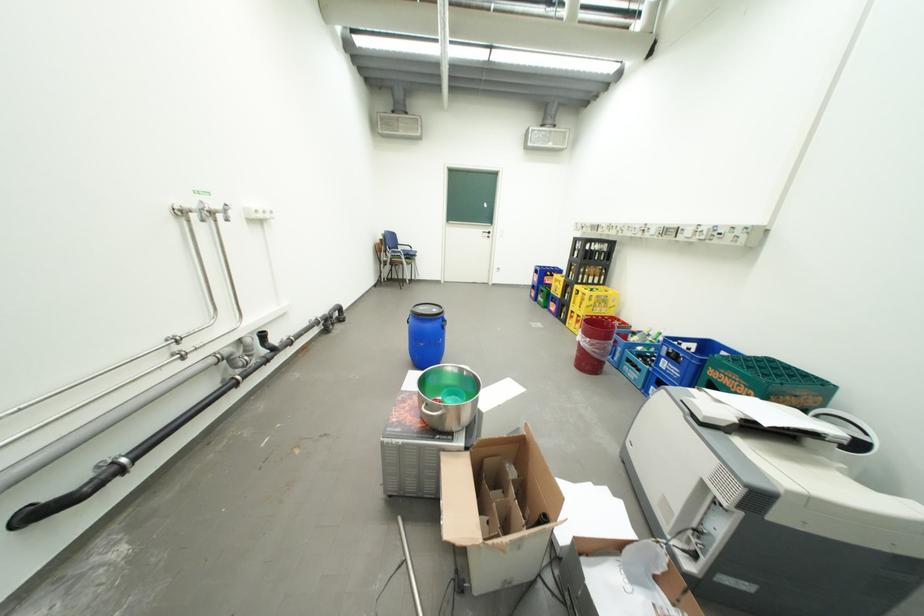
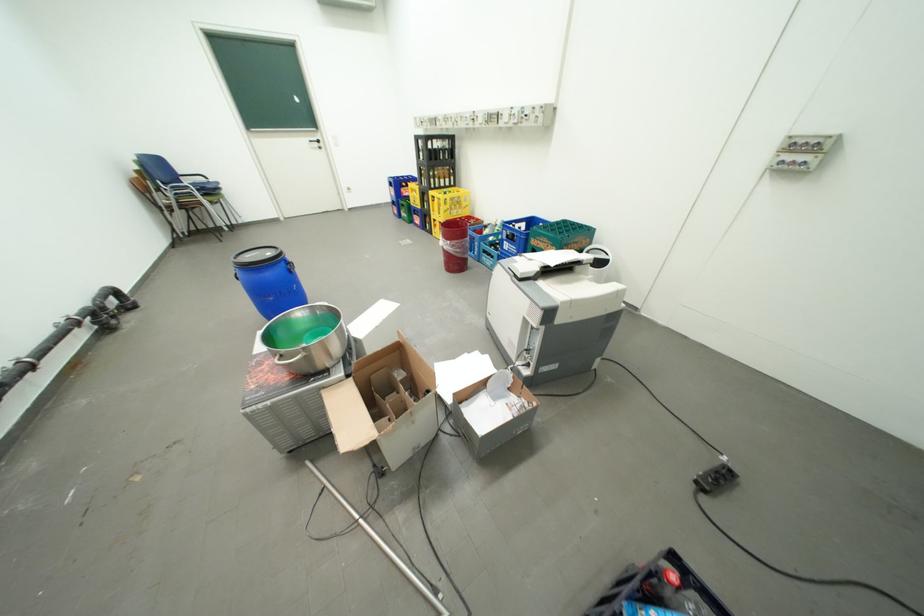
The point at (756, 387) is marked in the first image. Where is the corresponding point in the second image?

(562, 246)